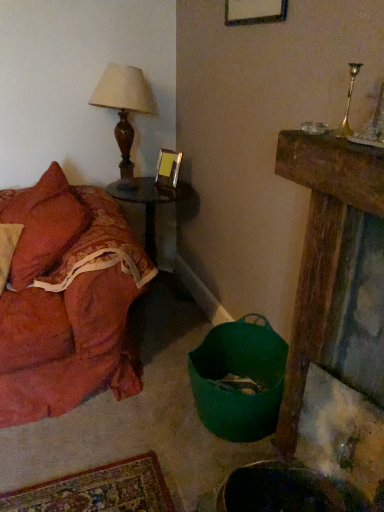
Question: Are metallic gold picture frame at upper center and wooden side table at center beside each other?

Choices:
 (A) yes
 (B) no

Answer: (B)

Question: Considering the relative positions of metallic gold picture frame at upper center and wooden side table at center in the image provided, is metallic gold picture frame at upper center to the left of wooden side table at center from the viewer's perspective?

Choices:
 (A) yes
 (B) no

Answer: (B)

Question: Is metallic gold picture frame at upper center looking in the opposite direction of wooden side table at center?

Choices:
 (A) no
 (B) yes

Answer: (A)

Question: Is metallic gold picture frame at upper center at the right side of wooden side table at center?

Choices:
 (A) yes
 (B) no

Answer: (A)

Question: Does metallic gold picture frame at upper center come behind wooden side table at center?

Choices:
 (A) yes
 (B) no

Answer: (A)

Question: From their relative heights in the image, would you say matte brown wood table lamp at upper left is taller or shorter than metallic gold picture frame at upper center?

Choices:
 (A) short
 (B) tall

Answer: (B)

Question: From a real-world perspective, relative to metallic gold picture frame at upper center, is matte brown wood table lamp at upper left vertically above or below?

Choices:
 (A) above
 (B) below

Answer: (A)

Question: Visually, is matte brown wood table lamp at upper left positioned to the left or to the right of metallic gold picture frame at upper center?

Choices:
 (A) right
 (B) left

Answer: (B)

Question: In terms of width, does matte brown wood table lamp at upper left look wider or thinner when compared to metallic gold picture frame at upper center?

Choices:
 (A) wide
 (B) thin

Answer: (A)

Question: From the image's perspective, relative to matte brown wood table lamp at upper left, is velvet orange couch at left above or below?

Choices:
 (A) below
 (B) above

Answer: (A)

Question: Which is correct: velvet orange couch at left is inside matte brown wood table lamp at upper left, or outside of it?

Choices:
 (A) outside
 (B) inside

Answer: (A)

Question: From a real-world perspective, relative to matte brown wood table lamp at upper left, is velvet orange couch at left vertically above or below?

Choices:
 (A) above
 (B) below

Answer: (B)

Question: Considering the positions of point (59, 379) and point (132, 170), is point (59, 379) closer or farther from the camera than point (132, 170)?

Choices:
 (A) farther
 (B) closer

Answer: (B)

Question: Would you say matte brown wood table lamp at upper left is inside or outside wooden side table at center?

Choices:
 (A) outside
 (B) inside

Answer: (A)

Question: From a real-world perspective, is matte brown wood table lamp at upper left above or below wooden side table at center?

Choices:
 (A) above
 (B) below

Answer: (A)